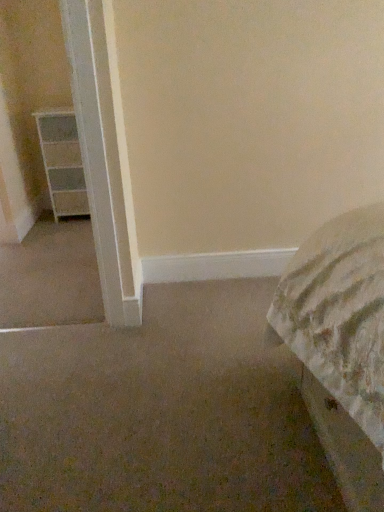
What do you see at coordinates (62, 163) in the screenshot?
I see `white wood cabinet at left` at bounding box center [62, 163].

Where is `white wood cabinet at left`? This screenshot has height=512, width=384. white wood cabinet at left is located at coordinates (62, 163).

In order to face white wood cabinet at left, should I rotate leftwards or rightwards?

You should look left and rotate roughly 16.408 degrees.

What is the approximate height of white wood cabinet at left?

28.96 inches.

This screenshot has width=384, height=512. Find the location of `white wood cabinet at left`. white wood cabinet at left is located at coordinates (62, 163).